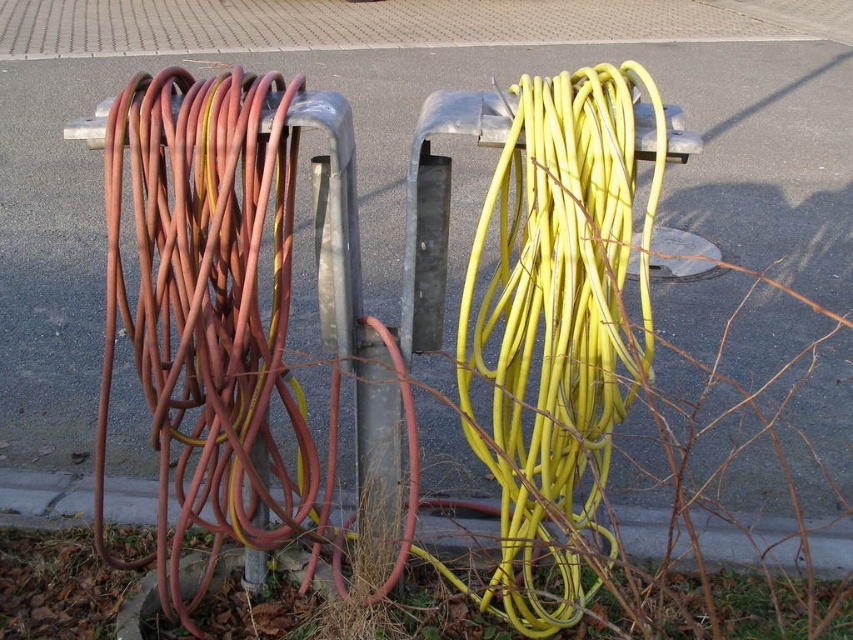
Question: Can you confirm if yellow rubber hose at center is positioned below gray concrete curb at lower center?

Choices:
 (A) no
 (B) yes

Answer: (A)

Question: Which object is the farthest from the gray concrete curb at lower center?

Choices:
 (A) matte red hose at left
 (B) yellow rubber hose at center

Answer: (A)

Question: Estimate the real-world distances between objects in this image. Which object is closer to the gray concrete curb at lower center?

Choices:
 (A) matte red hose at left
 (B) yellow rubber hose at center

Answer: (B)

Question: Considering the real-world distances, which object is closest to the matte red hose at left?

Choices:
 (A) gray concrete curb at lower center
 (B) yellow rubber hose at center

Answer: (B)

Question: Can you confirm if matte red hose at left is positioned to the right of gray concrete curb at lower center?

Choices:
 (A) no
 (B) yes

Answer: (A)

Question: Is matte red hose at left in front of yellow rubber hose at center?

Choices:
 (A) no
 (B) yes

Answer: (A)